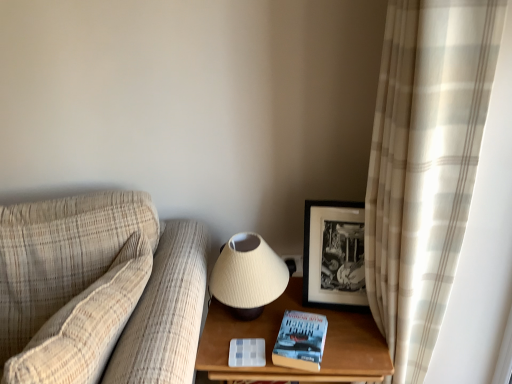
Question: From the image's perspective, is wooden table at lower right under matte cream lampshade at center?

Choices:
 (A) yes
 (B) no

Answer: (A)

Question: From a real-world perspective, is wooden table at lower right on top of matte cream lampshade at center?

Choices:
 (A) no
 (B) yes

Answer: (A)

Question: Does wooden table at lower right contain matte cream lampshade at center?

Choices:
 (A) yes
 (B) no

Answer: (B)

Question: From the image's perspective, is wooden table at lower right above matte cream lampshade at center?

Choices:
 (A) no
 (B) yes

Answer: (A)

Question: Does wooden table at lower right have a greater height compared to matte cream lampshade at center?

Choices:
 (A) yes
 (B) no

Answer: (A)

Question: Does point (416, 99) appear closer or farther from the camera than point (271, 354)?

Choices:
 (A) closer
 (B) farther

Answer: (A)

Question: Do you think beige plaid curtain at right is within hardcover blue book at lower right, or outside of it?

Choices:
 (A) outside
 (B) inside

Answer: (A)

Question: From a real-world perspective, is beige plaid curtain at right above or below hardcover blue book at lower right?

Choices:
 (A) above
 (B) below

Answer: (A)

Question: Considering their positions, is beige plaid curtain at right located in front of or behind hardcover blue book at lower right?

Choices:
 (A) front
 (B) behind

Answer: (A)

Question: From a real-world perspective, is beige plaid curtain at right physically located above or below wooden table at lower right?

Choices:
 (A) below
 (B) above

Answer: (B)

Question: Based on their positions, is beige plaid curtain at right located to the left or right of wooden table at lower right?

Choices:
 (A) left
 (B) right

Answer: (B)

Question: Is point (437, 43) closer or farther from the camera than point (382, 342)?

Choices:
 (A) farther
 (B) closer

Answer: (B)

Question: Is beige plaid curtain at right taller or shorter than wooden table at lower right?

Choices:
 (A) short
 (B) tall

Answer: (B)

Question: Is hardcover blue book at lower right taller or shorter than matte cream lampshade at center?

Choices:
 (A) short
 (B) tall

Answer: (A)

Question: From the image's perspective, is hardcover blue book at lower right above or below matte cream lampshade at center?

Choices:
 (A) above
 (B) below

Answer: (B)